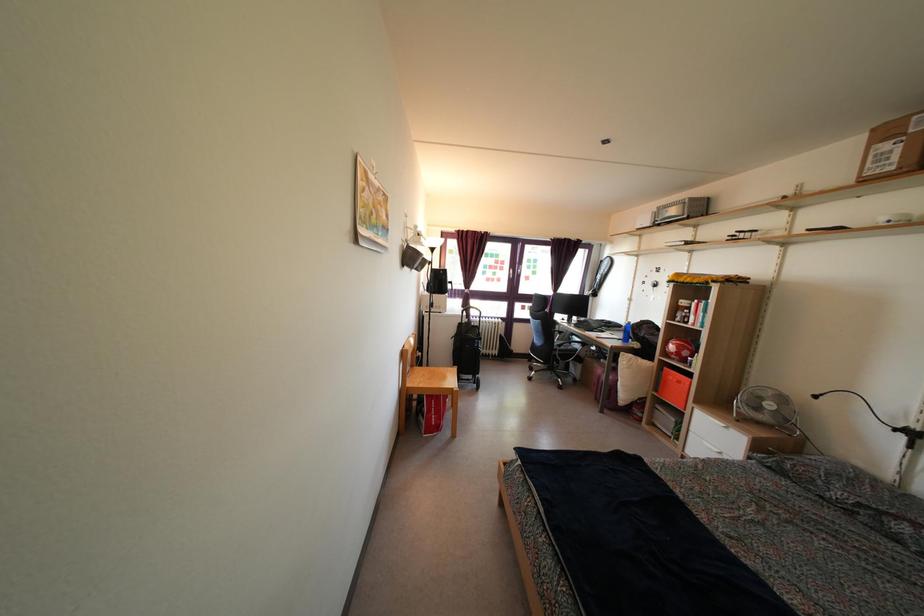
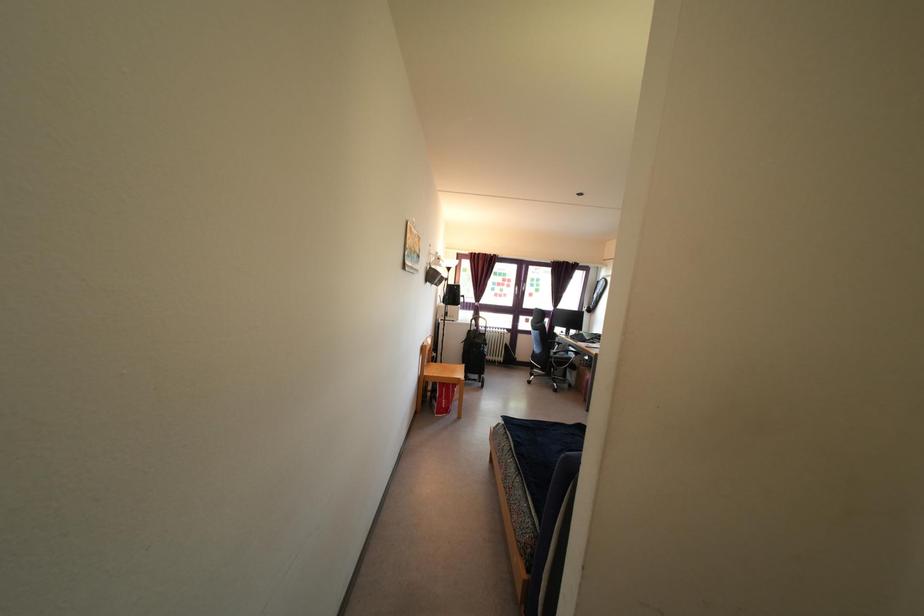
In the second image, find the point that corresponds to (x=464, y=333) in the first image.

(472, 339)